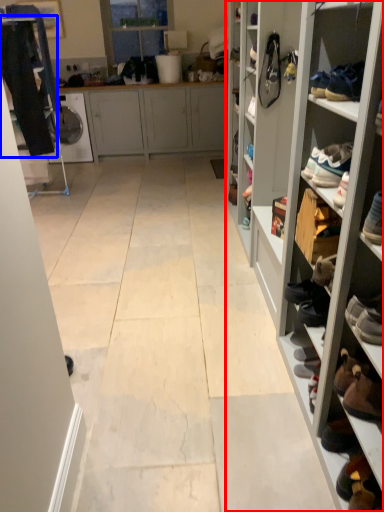
Question: Among these objects, which one is nearest to the camera, shelf (highlighted by a red box) or clothing (highlighted by a blue box)?

Choices:
 (A) shelf
 (B) clothing

Answer: (A)